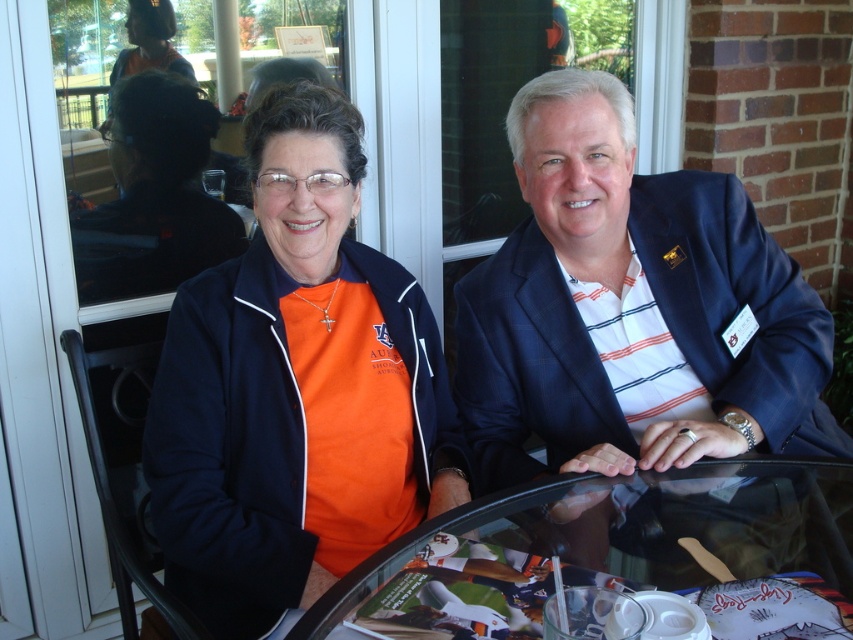
Who is more distant from viewer, [207,291] or [791,406]?

Positioned behind is point [791,406].

Is orange fabric shirt at center above blue fabric suit at center?

Incorrect, orange fabric shirt at center is not positioned above blue fabric suit at center.

Which is in front, point (274, 554) or point (498, 381)?

Point (274, 554)

Where is `orange fabric shirt at center`? orange fabric shirt at center is located at coordinates (294, 388).

From the picture: Is orange fabric shirt at center positioned behind transparent glass table at center?

Yes, orange fabric shirt at center is further from the viewer.

Is orange fabric shirt at center shorter than transparent glass table at center?

No, orange fabric shirt at center is not shorter than transparent glass table at center.

Is point (271, 193) farther from camera compared to point (616, 544)?

Yes.

Locate an element on the screen. orange fabric shirt at center is located at coordinates (294, 388).

Which is more to the right, blue fabric suit at center or transparent glass table at center?

blue fabric suit at center is more to the right.

Image resolution: width=853 pixels, height=640 pixels. Identify the location of blue fabric suit at center. (631, 308).